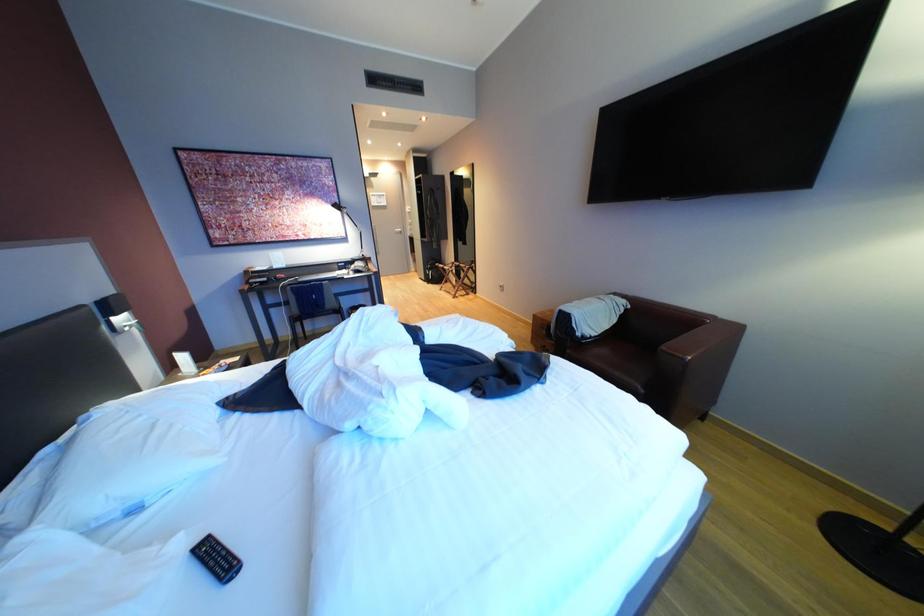
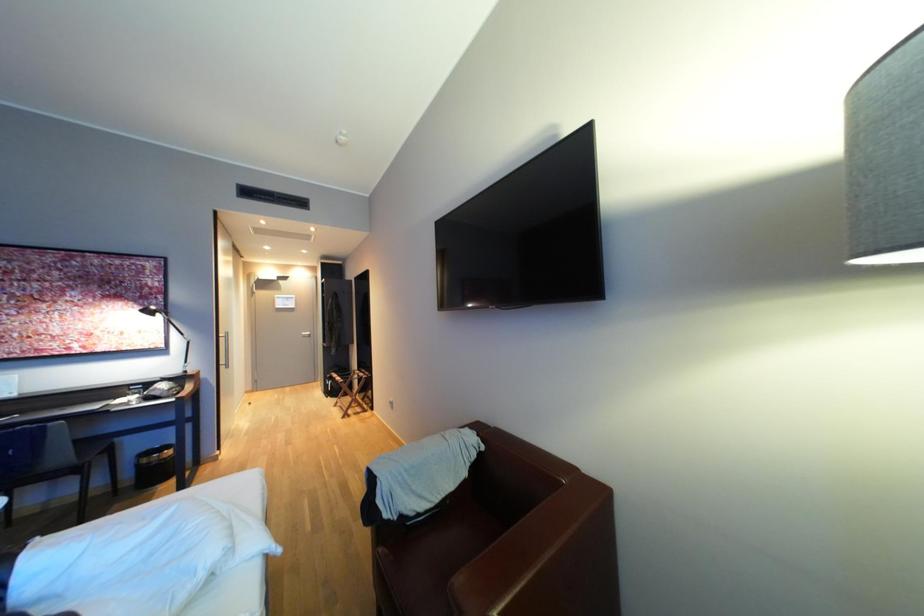
Which direction would the cameraman need to move to produce the second image?

The cameraman walked toward right, forward.